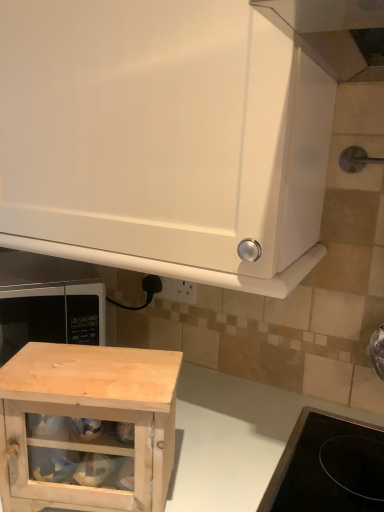
Where is `vacant area that lies to the right of natural wood cabinet at lower left, marked as the second cabinetry in a top-to-bottom arrangement`? vacant area that lies to the right of natural wood cabinet at lower left, marked as the second cabinetry in a top-to-bottom arrangement is located at coordinates (211, 466).